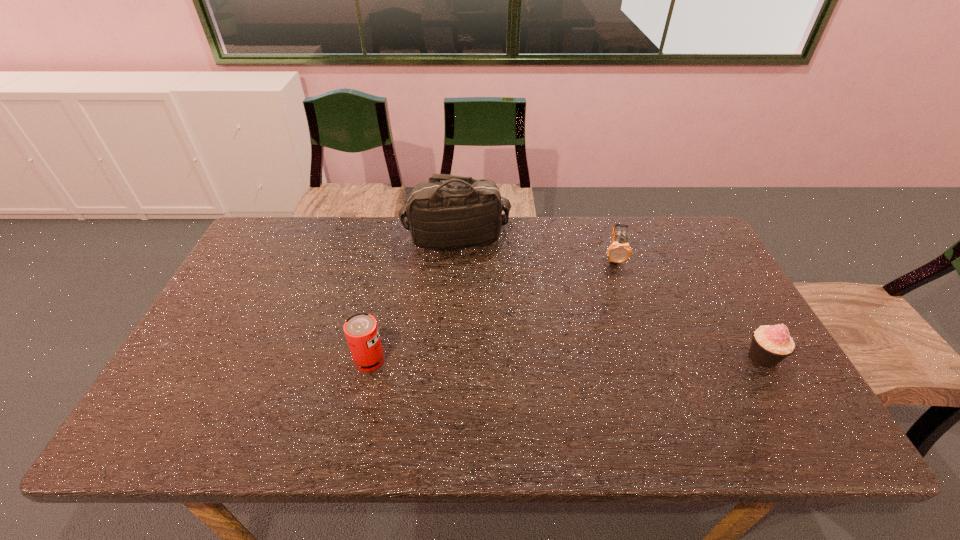
At what (x,y) coordinates should I click in order to perform the action: click on vacant space located at the front padded panel of the tallest object. Please return your answer as a coordinate pair (x, y). This screenshot has height=540, width=960. Looking at the image, I should click on (480, 266).

Where is `free space located at the front padded panel of the tallest object`? free space located at the front padded panel of the tallest object is located at coordinates (500, 300).

Where is `watch located in the far edge section of the desktop`? watch located in the far edge section of the desktop is located at coordinates (619, 251).

The image size is (960, 540). What are the coordinates of `shoulder bag at the far edge` in the screenshot? It's located at (457, 212).

Locate an element on the screen. object at the right edge is located at coordinates (770, 345).

Where is `free space at the far edge`? free space at the far edge is located at coordinates (571, 221).

I want to click on blank space at the near edge of the desktop, so click(x=571, y=386).

Identify the location of vacant point at the left edge. (248, 289).

The height and width of the screenshot is (540, 960). What are the coordinates of `vacant space at the right edge of the desktop` in the screenshot? It's located at (673, 265).

Where is `free space between the second tallest object and the watch`? This screenshot has width=960, height=540. free space between the second tallest object and the watch is located at coordinates (492, 309).